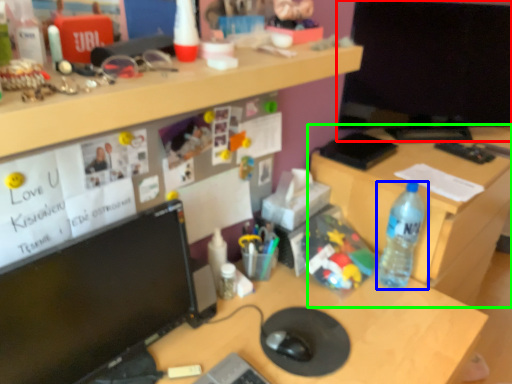
Question: Considering the real-world distances, which object is farthest from computer monitor (highlighted by a red box)? bottle (highlighted by a blue box) or desk (highlighted by a green box)?

Choices:
 (A) bottle
 (B) desk

Answer: (A)